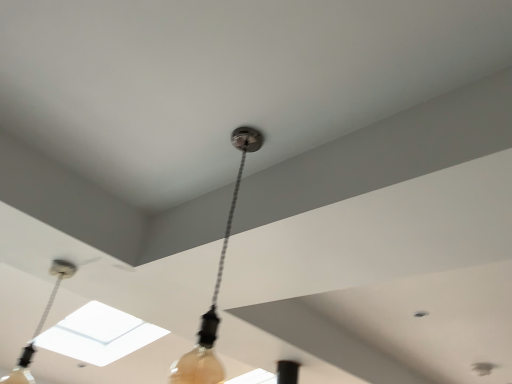
The width and height of the screenshot is (512, 384). Describe the element at coordinates (215, 289) in the screenshot. I see `matte black lamp at center, which ranks as the first lamp in front-to-back order` at that location.

The height and width of the screenshot is (384, 512). I want to click on matte black lamp at center, positioned as the 2th lamp in left-to-right order, so click(x=215, y=289).

This screenshot has height=384, width=512. What do you see at coordinates (39, 326) in the screenshot?
I see `matte black cord at upper center, the first lamp from the left` at bounding box center [39, 326].

Find the location of a particular element. This screenshot has height=384, width=512. matte black cord at upper center, the second lamp positioned from the right is located at coordinates (39, 326).

At what (x,y) coordinates should I click in order to perform the action: click on matte black lamp at center, acting as the second lamp starting from the back. Please return your answer as a coordinate pair (x, y). Looking at the image, I should click on (215, 289).

Which object is positioned more to the left, matte black cord at upper center, the second lamp positioned from the right, or matte black lamp at center, the first lamp in the right-to-left sequence?

matte black cord at upper center, the second lamp positioned from the right, is more to the left.

Which is in front, matte black cord at upper center, the second lamp positioned from the right, or matte black lamp at center, acting as the second lamp starting from the back?

matte black lamp at center, acting as the second lamp starting from the back, is closer to the camera.

Is point (36, 332) farther from camera compared to point (174, 366)?

That is True.

From the image's perspective, is matte black cord at upper center, which is counted as the second lamp, starting from the front, on top of matte black lamp at center, the first lamp in the right-to-left sequence?

Incorrect, from the image's perspective, matte black cord at upper center, which is counted as the second lamp, starting from the front, is lower than matte black lamp at center, the first lamp in the right-to-left sequence.

From a real-world perspective, is matte black cord at upper center, the first lamp from the left, above or below matte black lamp at center, which ranks as the first lamp in front-to-back order?

matte black cord at upper center, the first lamp from the left, is situated lower than matte black lamp at center, which ranks as the first lamp in front-to-back order, in the real world.

Is matte black cord at upper center, which appears as the first lamp when viewed from the back, wider or thinner than matte black lamp at center, positioned as the 2th lamp in left-to-right order?

In the image, matte black cord at upper center, which appears as the first lamp when viewed from the back, appears to be more narrow than matte black lamp at center, positioned as the 2th lamp in left-to-right order.

Is matte black cord at upper center, the second lamp positioned from the right, taller than matte black lamp at center, the first lamp in the right-to-left sequence?

No, matte black cord at upper center, the second lamp positioned from the right, is not taller than matte black lamp at center, the first lamp in the right-to-left sequence.

Is matte black cord at upper center, which appears as the first lamp when viewed from the back, smaller than matte black lamp at center, which ranks as the first lamp in front-to-back order?

Yes.

Is matte black lamp at center, which ranks as the first lamp in front-to-back order, located within matte black cord at upper center, which appears as the first lamp when viewed from the back?

No, matte black lamp at center, which ranks as the first lamp in front-to-back order, is located outside of matte black cord at upper center, which appears as the first lamp when viewed from the back.

Is matte black cord at upper center, which appears as the first lamp when viewed from the back, touching matte black lamp at center, acting as the second lamp starting from the back?

They are not placed beside each other.

Is matte black cord at upper center, the second lamp positioned from the right, positioned with its back to matte black lamp at center, positioned as the 2th lamp in left-to-right order?

Yes, matte black cord at upper center, the second lamp positioned from the right, is facing away from matte black lamp at center, positioned as the 2th lamp in left-to-right order.

Can you tell me how much matte black cord at upper center, which appears as the first lamp when viewed from the back, and matte black lamp at center, the first lamp in the right-to-left sequence, differ in facing direction?

There is a 92.5-degree angle between the facing directions of matte black cord at upper center, which appears as the first lamp when viewed from the back, and matte black lamp at center, the first lamp in the right-to-left sequence.

Locate an element on the screen. The height and width of the screenshot is (384, 512). lamp located below the matte black lamp at center, acting as the second lamp starting from the back (from the image's perspective) is located at coordinates (39, 326).

Can you confirm if matte black lamp at center, positioned as the 2th lamp in left-to-right order, is positioned to the left of matte black cord at upper center, the first lamp from the left?

No.

Does matte black lamp at center, the first lamp in the right-to-left sequence, lie in front of matte black cord at upper center, which is counted as the second lamp, starting from the front?

Yes, matte black lamp at center, the first lamp in the right-to-left sequence, is closer to the viewer.

Is point (251, 149) positioned behind point (25, 360)?

No, (251, 149) is in front of (25, 360).

From the image's perspective, who appears lower, matte black lamp at center, acting as the second lamp starting from the back, or matte black cord at upper center, the second lamp positioned from the right?

matte black cord at upper center, the second lamp positioned from the right, appears lower in the image.

From a real-world perspective, between matte black lamp at center, positioned as the 2th lamp in left-to-right order, and matte black cord at upper center, the first lamp from the left, who is vertically higher?

In real-world perspective, matte black lamp at center, positioned as the 2th lamp in left-to-right order, is above.

Considering the sizes of objects matte black lamp at center, which ranks as the first lamp in front-to-back order, and matte black cord at upper center, the first lamp from the left, in the image provided, who is thinner, matte black lamp at center, which ranks as the first lamp in front-to-back order, or matte black cord at upper center, the first lamp from the left,?

matte black cord at upper center, the first lamp from the left, is thinner.

Is matte black lamp at center, acting as the second lamp starting from the back, taller than matte black cord at upper center, the second lamp positioned from the right?

Yes.

Looking at the image, does matte black lamp at center, positioned as the 2th lamp in left-to-right order, seem bigger or smaller compared to matte black cord at upper center, the second lamp positioned from the right?

In the image, matte black lamp at center, positioned as the 2th lamp in left-to-right order, appears to be larger than matte black cord at upper center, the second lamp positioned from the right.

Does matte black lamp at center, the first lamp in the right-to-left sequence, contain matte black cord at upper center, which is counted as the second lamp, starting from the front?

No, matte black cord at upper center, which is counted as the second lamp, starting from the front, is not inside matte black lamp at center, the first lamp in the right-to-left sequence.

Is matte black lamp at center, positioned as the 2th lamp in left-to-right order, next to matte black cord at upper center, which appears as the first lamp when viewed from the back, and touching it?

matte black lamp at center, positioned as the 2th lamp in left-to-right order, and matte black cord at upper center, which appears as the first lamp when viewed from the back, are clearly separated.

Is matte black lamp at center, positioned as the 2th lamp in left-to-right order, turned away from matte black cord at upper center, which is counted as the second lamp, starting from the front?

No, matte black cord at upper center, which is counted as the second lamp, starting from the front, is not at the back of matte black lamp at center, positioned as the 2th lamp in left-to-right order.

At what (x,y) coordinates should I click in order to perform the action: click on lamp above the matte black cord at upper center, the second lamp positioned from the right (from a real-world perspective). Please return your answer as a coordinate pair (x, y). Looking at the image, I should click on (215, 289).

At what (x,y) coordinates should I click in order to perform the action: click on lamp in front of the matte black cord at upper center, the second lamp positioned from the right. Please return your answer as a coordinate pair (x, y). Image resolution: width=512 pixels, height=384 pixels. Looking at the image, I should click on (215, 289).

You are a GUI agent. You are given a task and a screenshot of the screen. Output one action in this format:
    pyautogui.click(x=<x>, y=<y>)
    Task: Click on the lamp to the right of matte black cord at upper center, which is counted as the second lamp, starting from the front
    This screenshot has width=512, height=384.
    Given the screenshot: What is the action you would take?
    pyautogui.click(x=215, y=289)